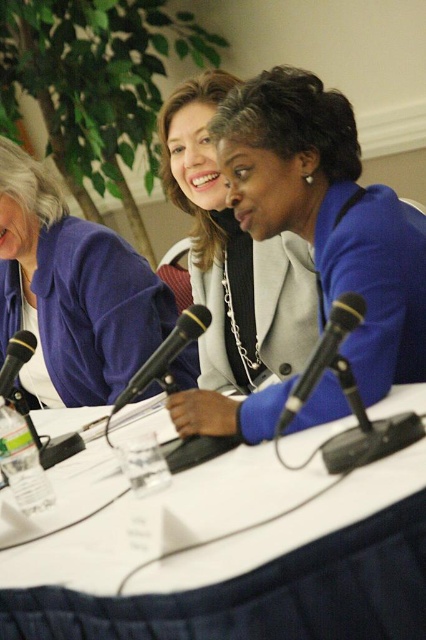
Question: Among these points, which one is farthest from the camera?

Choices:
 (A) (206, 321)
 (B) (23, 360)

Answer: (B)

Question: Can you confirm if white plastic table at center is positioned to the left of matte blue sweater at center?

Choices:
 (A) no
 (B) yes

Answer: (A)

Question: Which of the following is the closest to the observer?

Choices:
 (A) (22, 365)
 (B) (92, 227)
 (C) (175, 330)
 (D) (215, 304)

Answer: (C)

Question: Can you confirm if matte blue sweater at center is smaller than black plastic microphone at center?

Choices:
 (A) no
 (B) yes

Answer: (A)

Question: Is white plastic table at center smaller than black plastic microphone at left?

Choices:
 (A) yes
 (B) no

Answer: (B)

Question: Which object is the farthest from the black metallic microphone at center?

Choices:
 (A) black plastic microphone at center
 (B) matte blue sweater at center
 (C) white plastic table at center
 (D) matte blue blazer at center

Answer: (B)